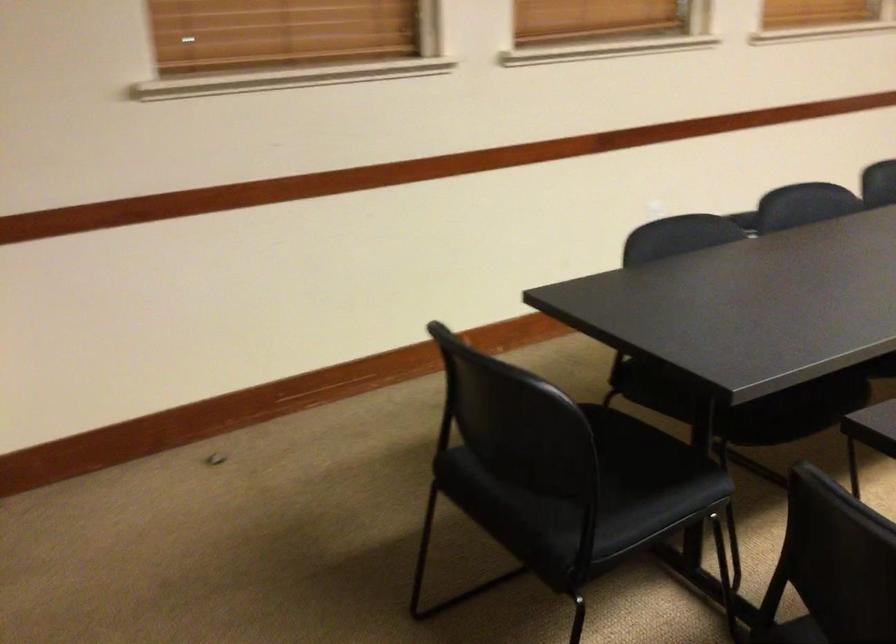
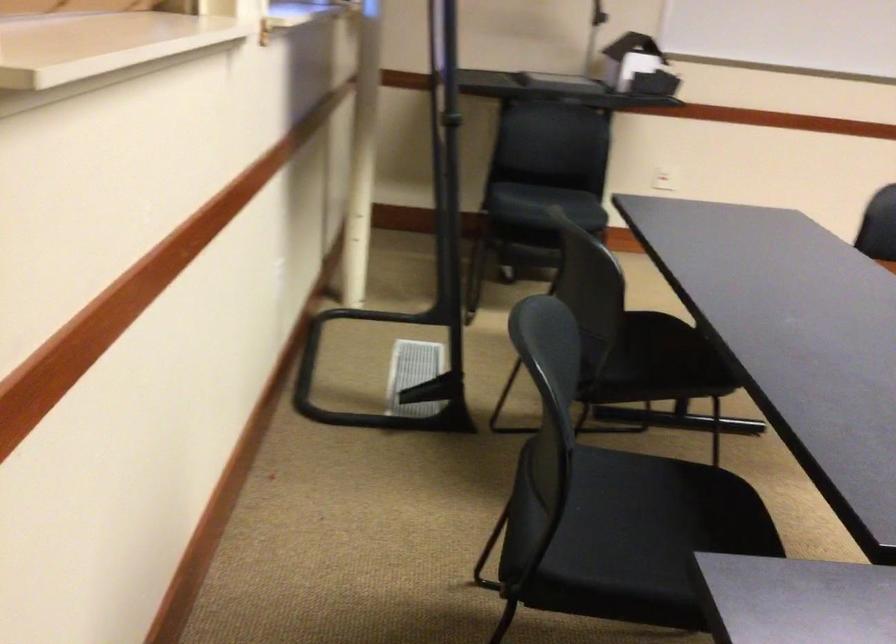
First-person continuous shooting, in which direction is the camera rotating?

The camera's rotation is toward right-down.